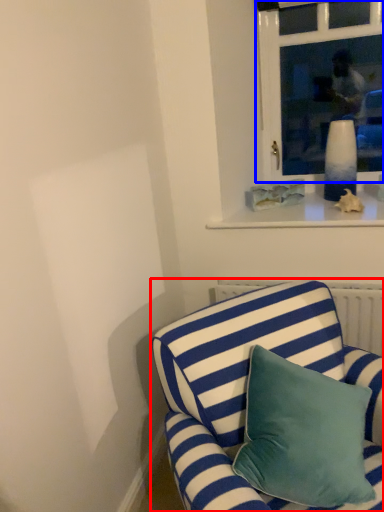
Question: Which point is closer to the camera, studio couch (highlighted by a red box) or window (highlighted by a blue box)?

Choices:
 (A) studio couch
 (B) window

Answer: (A)